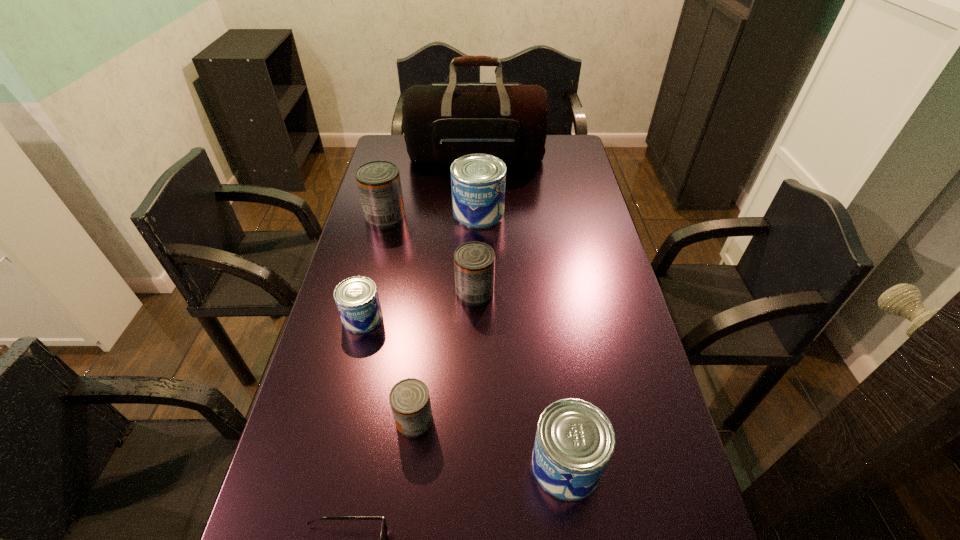
Image resolution: width=960 pixels, height=540 pixels. What are the coordinates of `vacant area at the right edge` in the screenshot? It's located at (556, 186).

What are the coordinates of `free space at the far right corner of the desktop` in the screenshot? It's located at (555, 135).

This screenshot has height=540, width=960. What are the coordinates of `empty space between the second biggest blue can and the farthest red can` in the screenshot? It's located at (476, 341).

The width and height of the screenshot is (960, 540). Identify the location of vacant point located between the biggest blue can and the farthest red can. (432, 214).

At what (x,y) coordinates should I click in order to perform the action: click on free spot between the second farthest blue can and the tallest object. Please return your answer as a coordinate pair (x, y). Looking at the image, I should click on (420, 237).

Find the location of a particular element. unoccupied area between the rightmost blue can and the red duffel bag is located at coordinates (521, 310).

You are a GUI agent. You are given a task and a screenshot of the screen. Output one action in this format:
    pyautogui.click(x=<x>, y=<y>)
    Task: Click on the free spot between the smallest blue can and the farthest red can
    
    Given the screenshot: What is the action you would take?
    pyautogui.click(x=373, y=267)

The image size is (960, 540). In order to click on free space between the duffel bag and the smallest blue can in this screenshot , I will do `click(420, 237)`.

Where is `object that is the fourth nearest to the second farthest red can`? The width and height of the screenshot is (960, 540). object that is the fourth nearest to the second farthest red can is located at coordinates (409, 399).

The height and width of the screenshot is (540, 960). Identify the location of object identified as the sixth closest to the nearest blue can. (379, 186).